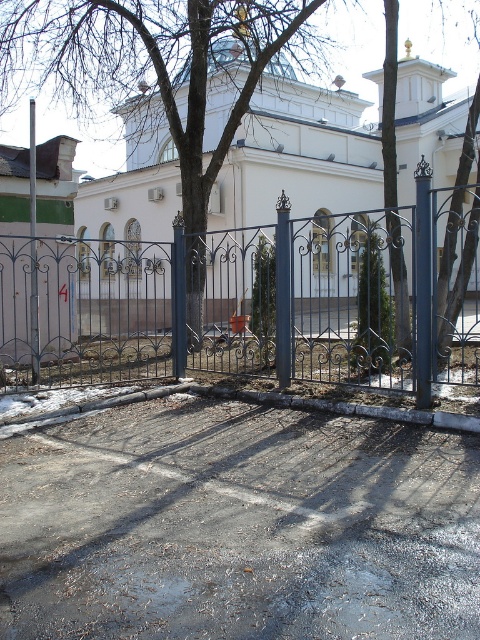
Measure the distance from metallic wrought iron fence at center to white matte fence at center.

A distance of 10.62 feet exists between metallic wrought iron fence at center and white matte fence at center.

Is metallic wrought iron fence at center thinner than white matte fence at center?

In fact, metallic wrought iron fence at center might be wider than white matte fence at center.

This screenshot has height=640, width=480. Identify the location of metallic wrought iron fence at center. (254, 301).

Find the location of a particular element. The width and height of the screenshot is (480, 640). metallic wrought iron fence at center is located at coordinates (254, 301).